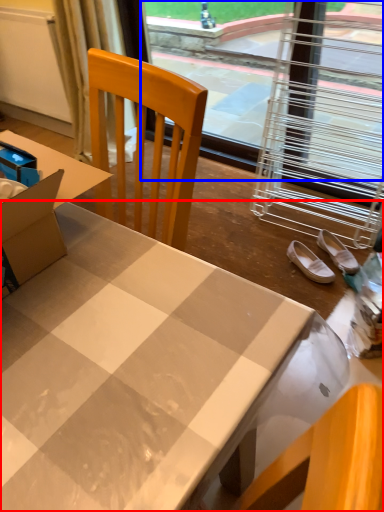
Question: Which point is closer to the camera, desk (highlighted by a red box) or window screen (highlighted by a blue box)?

Choices:
 (A) desk
 (B) window screen

Answer: (A)